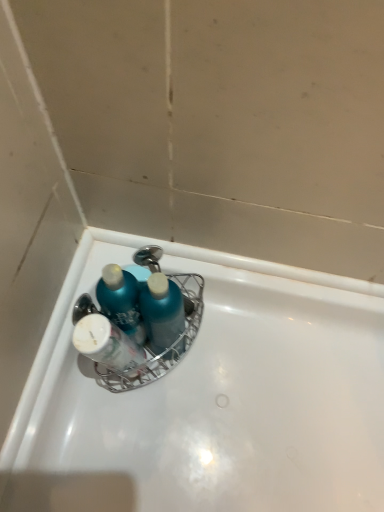
At what (x,y) coordinates should I click in order to perform the action: click on free space to the right of blue glossy bottle at upper center. Please return your answer as a coordinate pair (x, y). Looking at the image, I should click on (229, 346).